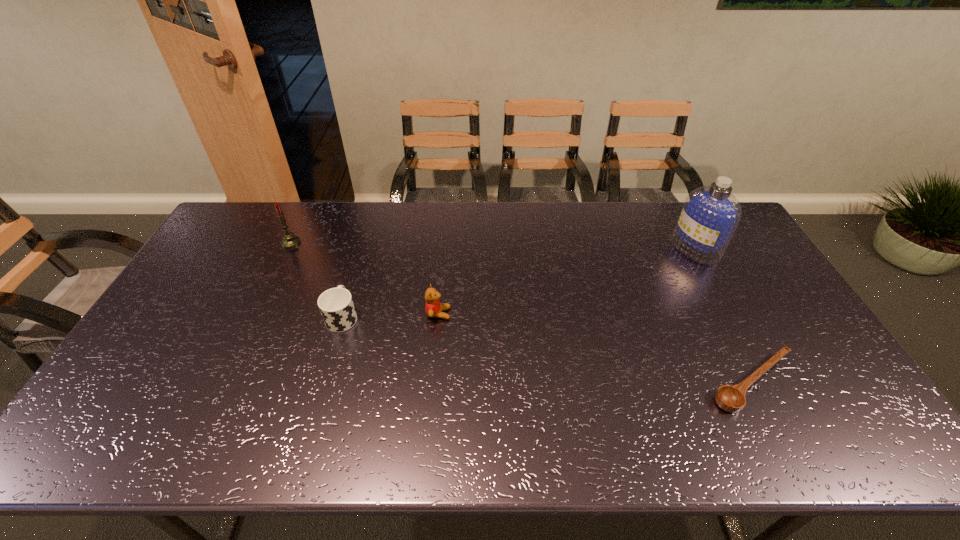
Find the location of a particular element. This screenshot has width=960, height=540. cleansing agent is located at coordinates (710, 214).

At what (x,y) coordinates should I click in order to perform the action: click on the leftmost object. Please return your answer as a coordinate pair (x, y). Looking at the image, I should click on (289, 240).

Where is `candle`? This screenshot has width=960, height=540. candle is located at coordinates (289, 240).

You are a GUI agent. You are given a task and a screenshot of the screen. Output one action in this format:
    pyautogui.click(x=<x>, y=<y>)
    Task: Click on the third shortest object
    This screenshot has height=540, width=960.
    Given the screenshot: What is the action you would take?
    pyautogui.click(x=433, y=308)

At what (x,y) coordinates should I click in order to perform the action: click on teddy bear. Please return your answer as a coordinate pair (x, y). The image size is (960, 540). Looking at the image, I should click on (433, 308).

Where is `the fourth object from right to left`? the fourth object from right to left is located at coordinates (336, 305).

The height and width of the screenshot is (540, 960). Find the location of `cup`. cup is located at coordinates (336, 305).

This screenshot has height=540, width=960. I want to click on the nearest object, so click(x=732, y=399).

Where is `the shortest object`? Image resolution: width=960 pixels, height=540 pixels. the shortest object is located at coordinates (732, 399).

Identify the location of vacant space located 0.080m on the left of the tallest object. (650, 248).